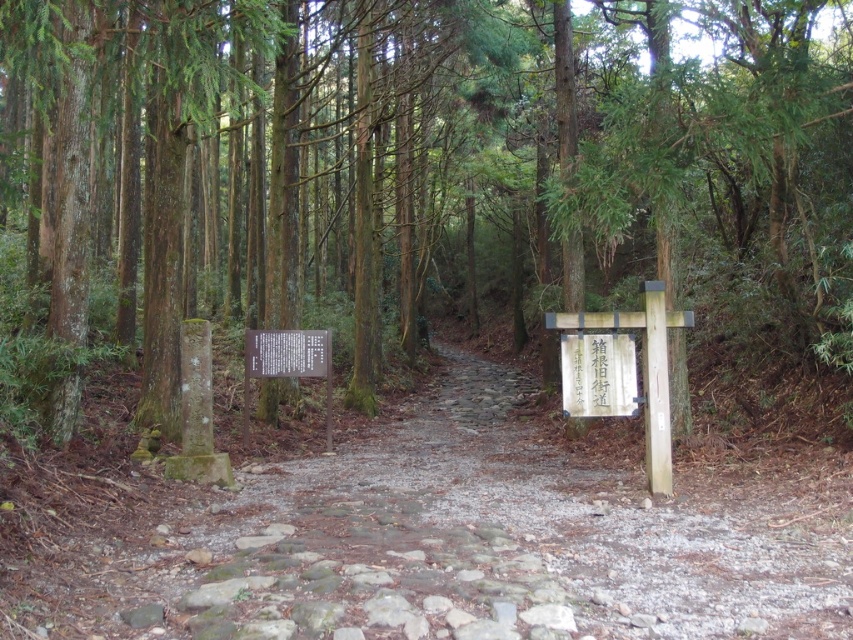
Question: Does green mossy trees at center appear over stone paved path at center?

Choices:
 (A) no
 (B) yes

Answer: (B)

Question: Which point is farther from the camera taking this photo?

Choices:
 (A) (592, 131)
 (B) (606, 381)
 (C) (519, 593)

Answer: (A)

Question: Which object is positioned farthest from the green mossy trees at center?

Choices:
 (A) stone paved path at center
 (B) white wooden sign at center-right

Answer: (B)

Question: Does green mossy trees at center have a smaller size compared to stone paved path at center?

Choices:
 (A) yes
 (B) no

Answer: (B)

Question: Estimate the real-world distances between objects in this image. Which object is farther from the stone paved path at center?

Choices:
 (A) white wooden sign at center-right
 (B) green mossy trees at center

Answer: (B)

Question: Does green mossy trees at center appear over white wooden sign at center-right?

Choices:
 (A) yes
 (B) no

Answer: (A)